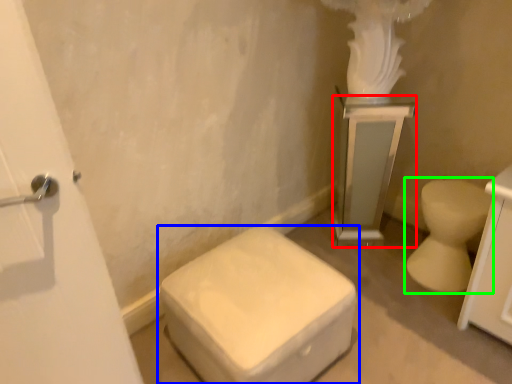
Question: Which object is the farthest from medicine cabinet (highlighted by a red box)? Choose among these: toilet (highlighted by a blue box) or toilet (highlighted by a green box).

Choices:
 (A) toilet
 (B) toilet

Answer: (A)